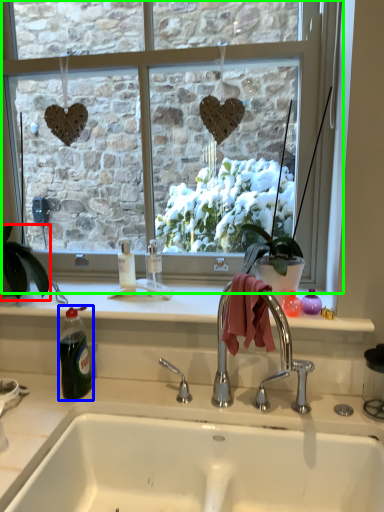
Question: Considering the real-world distances, which object is farthest from houseplant (highlighted by a red box)? bottle (highlighted by a blue box) or window (highlighted by a green box)?

Choices:
 (A) bottle
 (B) window

Answer: (B)